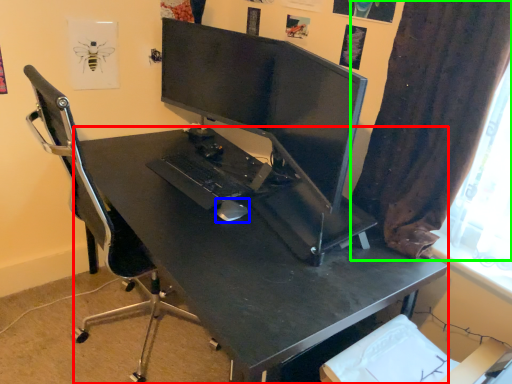
Question: Which is nearer to the desk (highlighted by a red box)? mouse (highlighted by a blue box) or curtain (highlighted by a green box).

Choices:
 (A) mouse
 (B) curtain

Answer: (A)